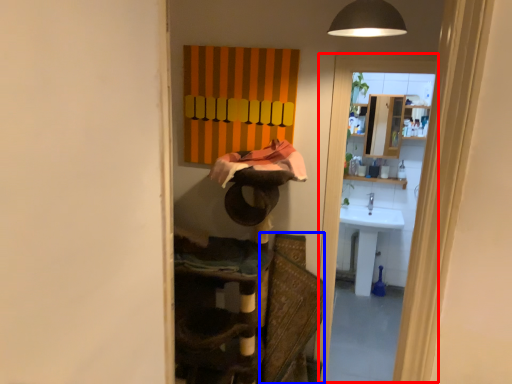
Question: Among these objects, which one is farthest to the camera, screen door (highlighted by a red box) or swivel chair (highlighted by a blue box)?

Choices:
 (A) screen door
 (B) swivel chair

Answer: (A)